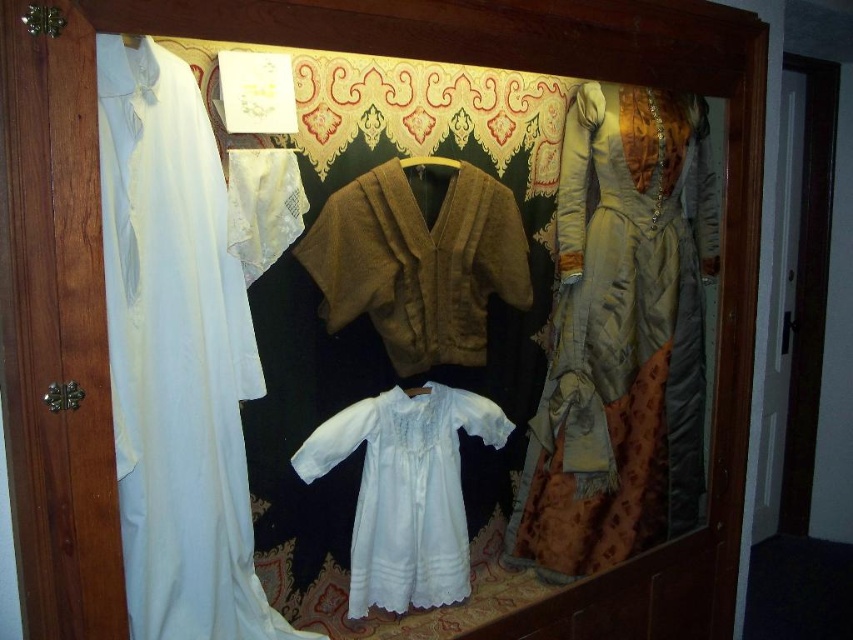
You are standing in front of the display case and notice a point marked at coordinates (418, 262). Which object in the display case does this point correspond to?

The point at coordinates (418, 262) corresponds to the brown textured sweater at center.

You are a museum curator preparing to adjust the display in the case. You need to ensure that the brown textured sweater at center fits within its brown fabric hanger at center. Based on the description, will the sweater fit properly on the hanger?

The brown textured sweater at center is wider than the brown fabric hanger at center, so it may not fit properly on the hanger.